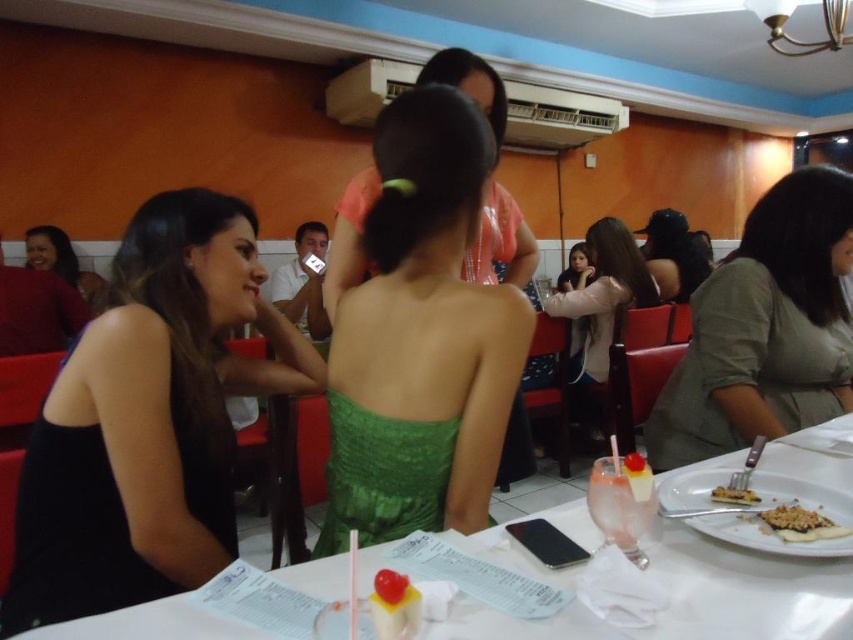
Is matte olive green blouse at right smaller than pink glass drink at table center?

No, matte olive green blouse at right is not smaller than pink glass drink at table center.

Which of these two, matte olive green blouse at right or pink glass drink at table center, stands shorter?

pink glass drink at table center

Who is more forward, (737, 355) or (595, 500)?

Point (595, 500) is in front.

Where is `matte olive green blouse at right`? Image resolution: width=853 pixels, height=640 pixels. matte olive green blouse at right is located at coordinates (764, 328).

Consider the image. Can you confirm if green satin dress at center is shorter than light pink fabric jacket at center?

Yes.

Is green satin dress at center smaller than light pink fabric jacket at center?

Correct, green satin dress at center occupies less space than light pink fabric jacket at center.

Does point (450, 269) come farther from viewer compared to point (619, 260)?

No, (450, 269) is in front of (619, 260).

Locate an element on the screen. The width and height of the screenshot is (853, 640). green satin dress at center is located at coordinates (421, 339).

Is matte olive green blouse at right to the right of crumbly brown cake at lower right from the viewer's perspective?

Correct, you'll find matte olive green blouse at right to the right of crumbly brown cake at lower right.

Which is behind, point (711, 296) or point (730, 492)?

Positioned behind is point (711, 296).

Does point (759, 360) come farther from viewer compared to point (729, 486)?

Yes, point (759, 360) is farther from viewer.

Identify the location of matte olive green blouse at right. (764, 328).